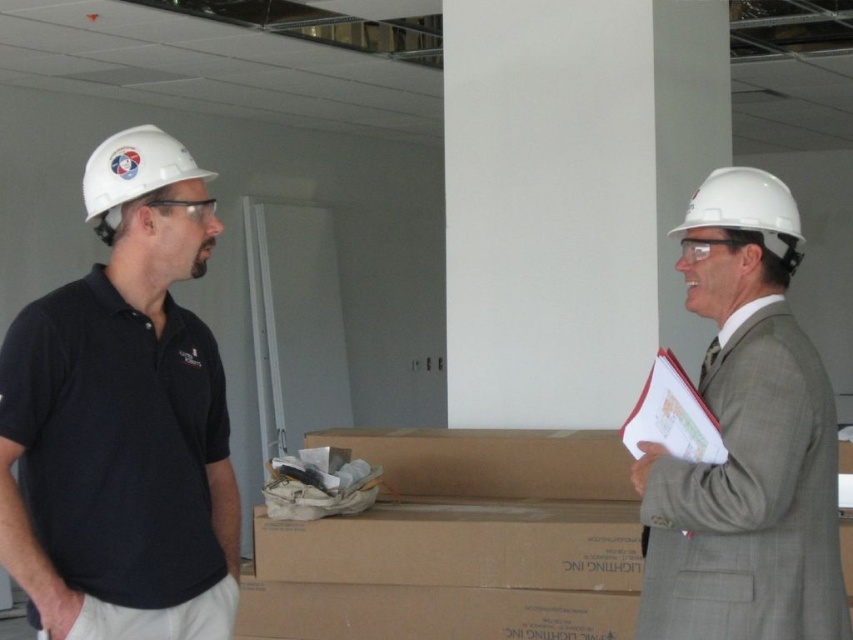
Image resolution: width=853 pixels, height=640 pixels. What do you see at coordinates (746, 442) in the screenshot? I see `white hard hat at right` at bounding box center [746, 442].

Image resolution: width=853 pixels, height=640 pixels. Identify the location of white hard hat at right. (x=746, y=442).

Where is `white hard hat at right`? white hard hat at right is located at coordinates (746, 442).

Between matte black polo shirt at left and white hard hat at left, which one appears on the right side from the viewer's perspective?

white hard hat at left

Is matte black polo shirt at left smaller than white hard hat at left?

No, matte black polo shirt at left is not smaller than white hard hat at left.

Find the location of `matte black polo shirt at left`. matte black polo shirt at left is located at coordinates (123, 419).

Can you confirm if matte black polo shirt at left is positioned below white hard hat at right?

Actually, matte black polo shirt at left is above white hard hat at right.

Who is positioned more to the left, matte black polo shirt at left or white hard hat at right?

From the viewer's perspective, matte black polo shirt at left appears more on the left side.

Is point (146, 557) farther from camera compared to point (648, 584)?

No, (146, 557) is closer to viewer.

Where is `matte black polo shirt at left`? The height and width of the screenshot is (640, 853). matte black polo shirt at left is located at coordinates (123, 419).